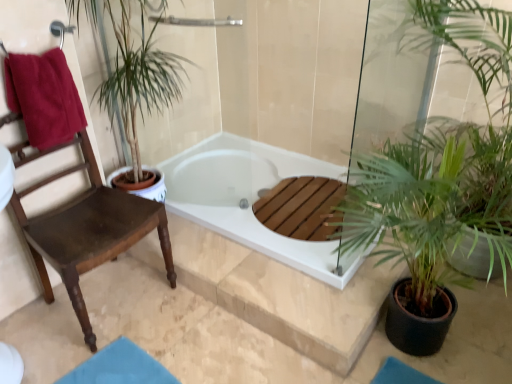
Question: Is maroon cotton towel at left directly adjacent to wooden chair at left?

Choices:
 (A) yes
 (B) no

Answer: (B)

Question: Considering the relative sizes of maroon cotton towel at left and wooden chair at left in the image provided, is maroon cotton towel at left bigger than wooden chair at left?

Choices:
 (A) no
 (B) yes

Answer: (A)

Question: From the image's perspective, is maroon cotton towel at left under wooden chair at left?

Choices:
 (A) yes
 (B) no

Answer: (B)

Question: From the image's perspective, is maroon cotton towel at left over wooden chair at left?

Choices:
 (A) no
 (B) yes

Answer: (B)

Question: Is maroon cotton towel at left wider than wooden chair at left?

Choices:
 (A) no
 (B) yes

Answer: (A)

Question: Is maroon cotton towel at left positioned beyond the bounds of wooden chair at left?

Choices:
 (A) no
 (B) yes

Answer: (A)

Question: Is maroon cotton towel at left oriented away from white glossy bathtub at center?

Choices:
 (A) no
 (B) yes

Answer: (A)

Question: Does maroon cotton towel at left have a lesser height compared to white glossy bathtub at center?

Choices:
 (A) no
 (B) yes

Answer: (A)

Question: Considering the relative sizes of maroon cotton towel at left and white glossy bathtub at center in the image provided, is maroon cotton towel at left wider than white glossy bathtub at center?

Choices:
 (A) no
 (B) yes

Answer: (A)

Question: Is maroon cotton towel at left in contact with white glossy bathtub at center?

Choices:
 (A) yes
 (B) no

Answer: (B)

Question: Is maroon cotton towel at left aimed at white glossy bathtub at center?

Choices:
 (A) no
 (B) yes

Answer: (A)

Question: Is maroon cotton towel at left not within white glossy bathtub at center?

Choices:
 (A) no
 (B) yes

Answer: (B)

Question: Can you see wooden chair at left touching white glossy bathtub at center?

Choices:
 (A) no
 (B) yes

Answer: (A)